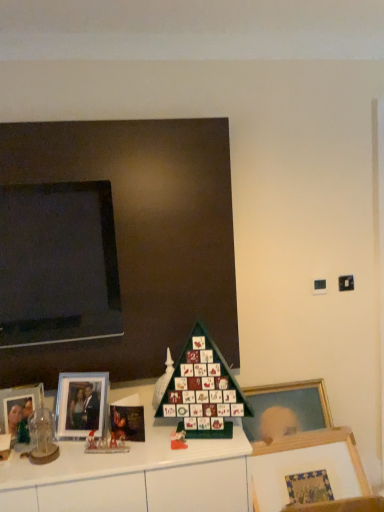
Where is `vacant space that is to the left of green matte advent calendar at center`? vacant space that is to the left of green matte advent calendar at center is located at coordinates click(x=139, y=450).